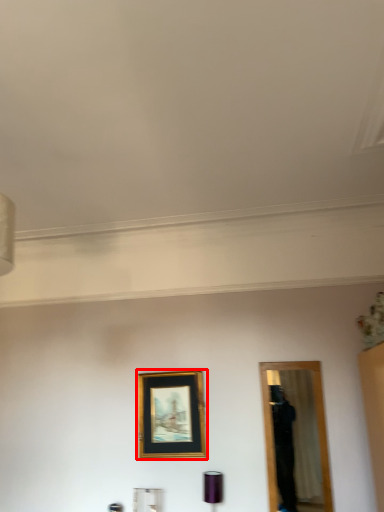
Question: Where is picture frame (annotated by the red box) located in relation to lamp in the image?

Choices:
 (A) left
 (B) right

Answer: (A)